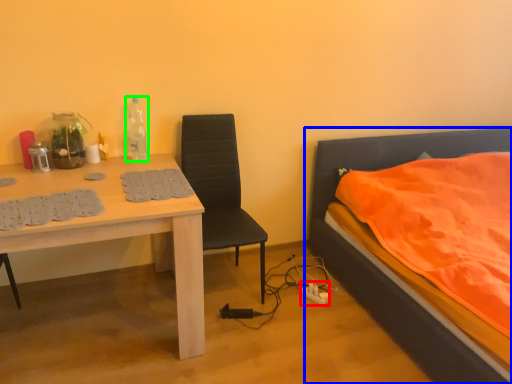
Question: Estimate the real-world distances between objects in this image. Which object is closer to power outlet (highlighted by a red box), bed (highlighted by a blue box) or bottle (highlighted by a green box)?

Choices:
 (A) bed
 (B) bottle

Answer: (A)